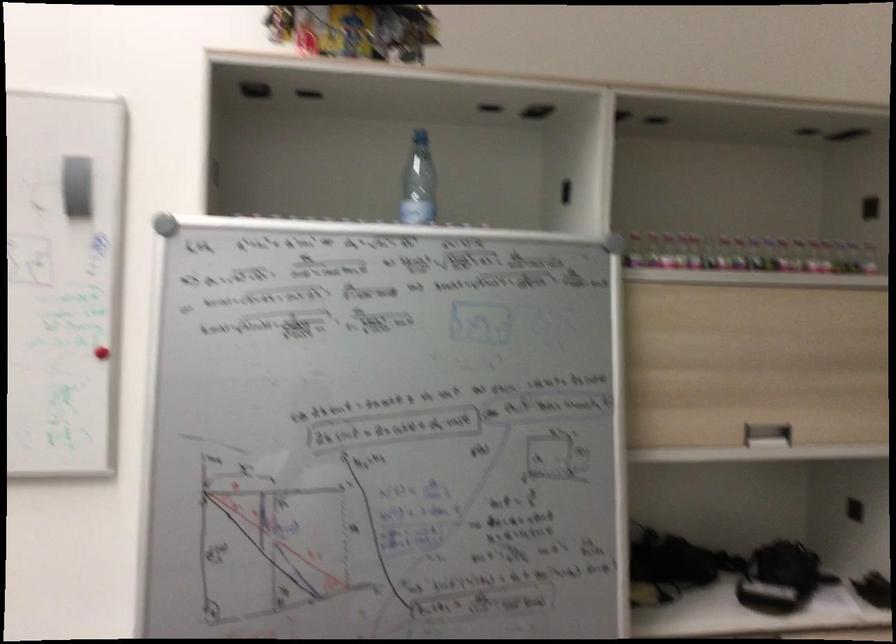
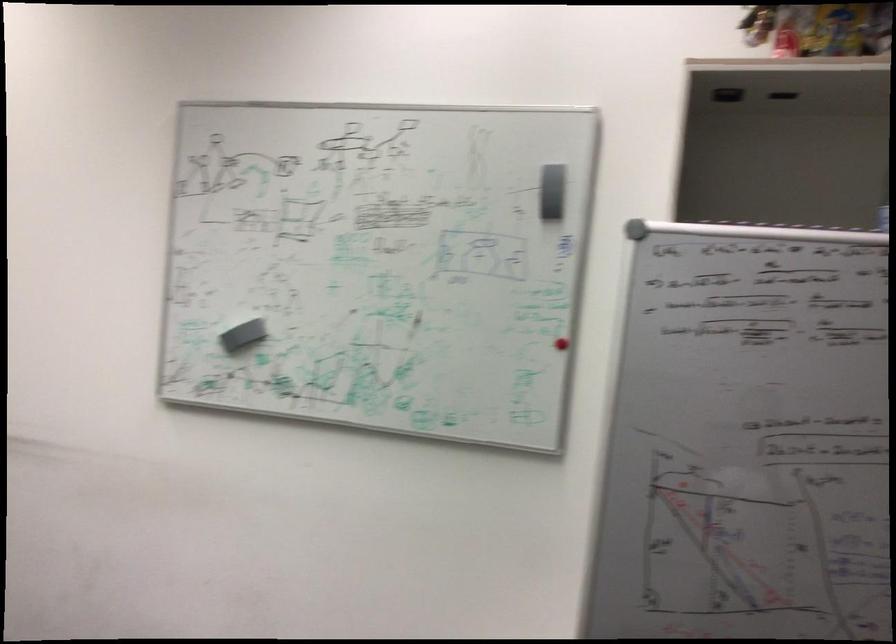
In the second image, find the point that corresponds to (118,351) in the first image.

(564, 341)